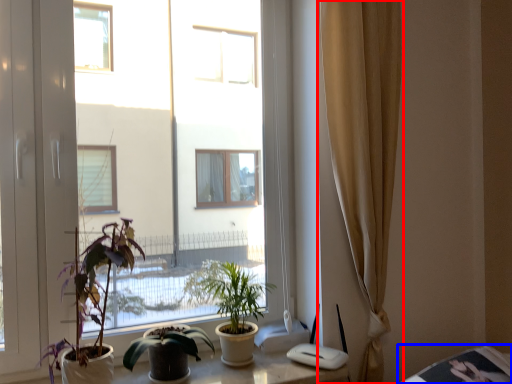
Question: Which object is further to the camera taking this photo, curtain (highlighted by a red box) or table (highlighted by a blue box)?

Choices:
 (A) curtain
 (B) table

Answer: (A)